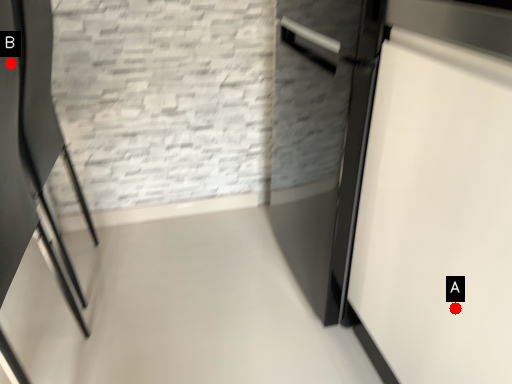
Question: Two points are circled on the image, labeled by A and B beside each circle. Which point is closer to the camera?

Choices:
 (A) A is closer
 (B) B is closer

Answer: (A)